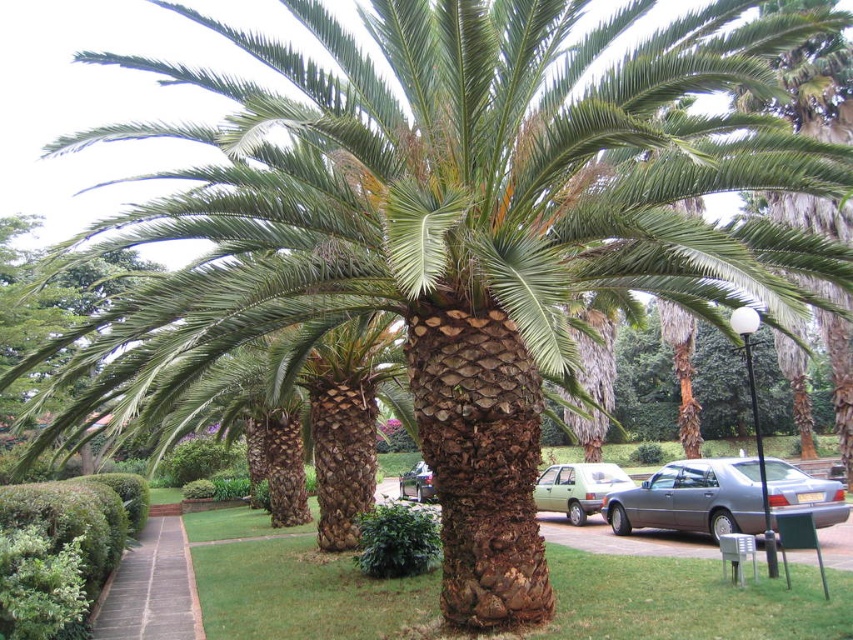
You are a gardener who needs to trim the green leafy hedge at lower left. You have a ladder placed near the green matte sedan at center. Can you reach the hedge from your current position without moving the ladder?

The green leafy hedge at lower left is in front of the green matte sedan at center, so the ladder is behind the hedge. Therefore, you cannot reach the hedge from your current position without moving the ladder.

You are a gardener planning to water the green leafy hedge at lower left and the green leafy hedge at center. If your watering can holds enough water for 15 feet of travel between refills, can you water both hedges without needing to refill?

The green leafy hedge at lower left is 14.64 feet from the green leafy hedge at center. Since 14.64 feet is less than 15 feet, you can water both hedges without needing to refill your watering can.